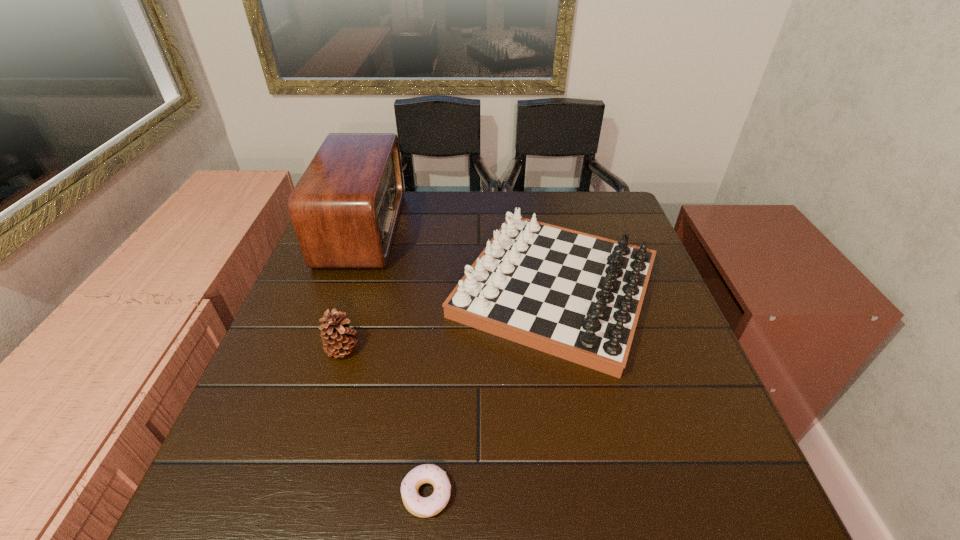
Identify the location of gameboard that is at the far edge. (577, 296).

Locate an element on the screen. object located at the near edge is located at coordinates (423, 507).

Where is `radio receiver at the left edge`? This screenshot has width=960, height=540. radio receiver at the left edge is located at coordinates (345, 208).

Where is `pinecone located at the left edge`? The width and height of the screenshot is (960, 540). pinecone located at the left edge is located at coordinates (337, 340).

Find the location of `object present at the right edge`. object present at the right edge is located at coordinates (577, 296).

Locate an element on the screen. object at the far left corner is located at coordinates (345, 208).

The height and width of the screenshot is (540, 960). I want to click on object that is at the far right corner, so click(577, 296).

Identify the location of free spot at the far edge of the desktop. The width and height of the screenshot is (960, 540). (532, 211).

Find the location of `blank space at the near edge`. blank space at the near edge is located at coordinates (599, 498).

You are a GUI agent. You are given a task and a screenshot of the screen. Output one action in this format:
    pyautogui.click(x=<x>, y=<y>)
    Task: Click on the vacant space at the left edge of the desktop
    This screenshot has width=960, height=540.
    Given the screenshot: What is the action you would take?
    pyautogui.click(x=329, y=271)